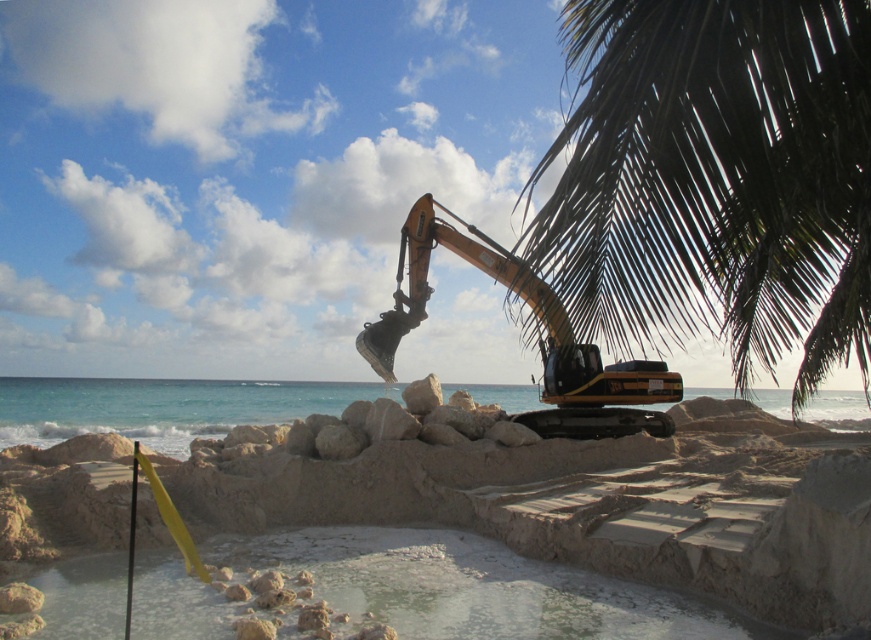
Between smooth sand beach at center and dark green leafy palm tree at upper right, which one is positioned lower?

Positioned lower is smooth sand beach at center.

Between smooth sand beach at center and dark green leafy palm tree at upper right, which one has less height?

smooth sand beach at center is shorter.

Is point (52, 605) farther from viewer compared to point (711, 84)?

Yes, point (52, 605) is behind point (711, 84).

Find the location of a particular element. The image size is (871, 640). smooth sand beach at center is located at coordinates (517, 538).

From the picture: Can you confirm if smooth sand beach at center is bigger than yellow metallic excavator at center?

Yes, smooth sand beach at center is bigger than yellow metallic excavator at center.

Which is in front, point (714, 493) or point (422, 305)?

Point (714, 493)

Image resolution: width=871 pixels, height=640 pixels. In order to click on smooth sand beach at center in this screenshot , I will do `click(517, 538)`.

Is the position of dark green leafy palm tree at upper right less distant than that of yellow metallic excavator at center?

That is True.

Who is taller, dark green leafy palm tree at upper right or yellow metallic excavator at center?

dark green leafy palm tree at upper right is taller.

Between point (620, 44) and point (379, 353), which one is positioned behind?

The point (379, 353) is behind.

Identify the location of dark green leafy palm tree at upper right. (714, 179).